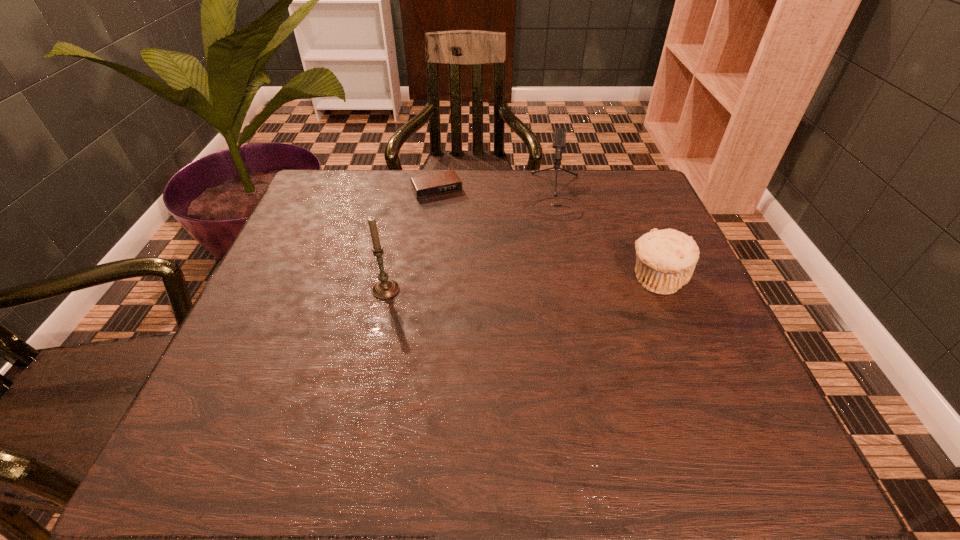
At what (x,y) coordinates should I click in order to perform the action: click on candle. Please return your answer as a coordinate pair (x, y). The width and height of the screenshot is (960, 540). Looking at the image, I should click on (386, 288).

Identify the location of muffin. The image size is (960, 540). (666, 259).

Locate an element on the screen. the second shortest object is located at coordinates (666, 259).

Locate an element on the screen. Image resolution: width=960 pixels, height=540 pixels. alarm clock is located at coordinates (444, 183).

Locate an element on the screen. the second object from right to left is located at coordinates (559, 140).

The width and height of the screenshot is (960, 540). I want to click on free space located 0.220m on the back of the tallest object, so click(401, 219).

Locate an element on the screen. blank space located on the left of the muffin is located at coordinates (469, 280).

Locate an element on the screen. The image size is (960, 540). vacant space situated 0.150m on the front face of the shortest object is located at coordinates (463, 233).

Where is `free location located 0.230m on the front face of the shortest object`? free location located 0.230m on the front face of the shortest object is located at coordinates (473, 253).

This screenshot has width=960, height=540. Find the location of `blank space located on the front face of the shortest object`. blank space located on the front face of the shortest object is located at coordinates (459, 226).